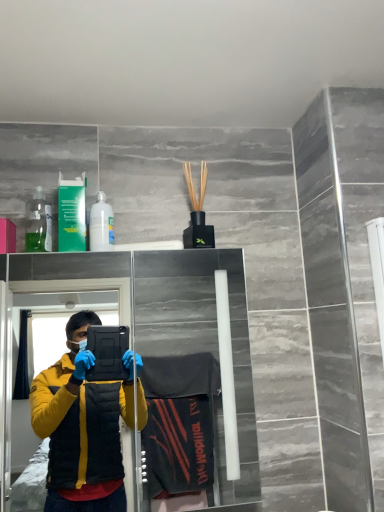
Question: Should I look upward or downward to see transparent glass door at upper center?

Choices:
 (A) up
 (B) down

Answer: (B)

Question: From a real-world perspective, is white matte bottle at upper left located beneath transparent glass door at upper center?

Choices:
 (A) yes
 (B) no

Answer: (B)

Question: From the image's perspective, is white matte bottle at upper left under transparent glass door at upper center?

Choices:
 (A) no
 (B) yes

Answer: (A)

Question: Considering the relative sizes of white matte bottle at upper left and transparent glass door at upper center in the image provided, is white matte bottle at upper left taller than transparent glass door at upper center?

Choices:
 (A) yes
 (B) no

Answer: (B)

Question: Does white matte bottle at upper left have a lesser width compared to transparent glass door at upper center?

Choices:
 (A) no
 (B) yes

Answer: (B)

Question: Does white matte bottle at upper left lie behind transparent glass door at upper center?

Choices:
 (A) yes
 (B) no

Answer: (A)

Question: Considering the relative sizes of white matte bottle at upper left and transparent glass door at upper center in the image provided, is white matte bottle at upper left wider than transparent glass door at upper center?

Choices:
 (A) yes
 (B) no

Answer: (B)

Question: Is transparent glass door at upper center not close to transparent plastic bottle at upper left?

Choices:
 (A) yes
 (B) no

Answer: (A)

Question: From the image's perspective, is transparent glass door at upper center located beneath transparent plastic bottle at upper left?

Choices:
 (A) no
 (B) yes

Answer: (B)

Question: Is transparent glass door at upper center turned away from transparent plastic bottle at upper left?

Choices:
 (A) yes
 (B) no

Answer: (B)

Question: From a real-world perspective, is transparent glass door at upper center on top of transparent plastic bottle at upper left?

Choices:
 (A) yes
 (B) no

Answer: (B)

Question: Is transparent glass door at upper center outside of transparent plastic bottle at upper left?

Choices:
 (A) yes
 (B) no

Answer: (A)

Question: Does transparent glass door at upper center come in front of transparent plastic bottle at upper left?

Choices:
 (A) no
 (B) yes

Answer: (B)

Question: Is transparent plastic bottle at upper left closer to camera compared to white matte bottle at upper left?

Choices:
 (A) no
 (B) yes

Answer: (A)